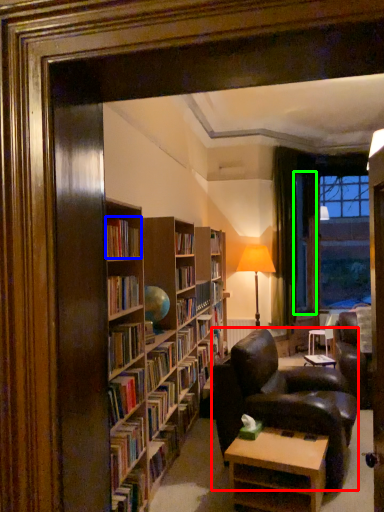
Question: Which object is the closest to the chair (highlighted by a red box)? Choose among these: book (highlighted by a blue box) or glass door (highlighted by a green box).

Choices:
 (A) book
 (B) glass door

Answer: (A)